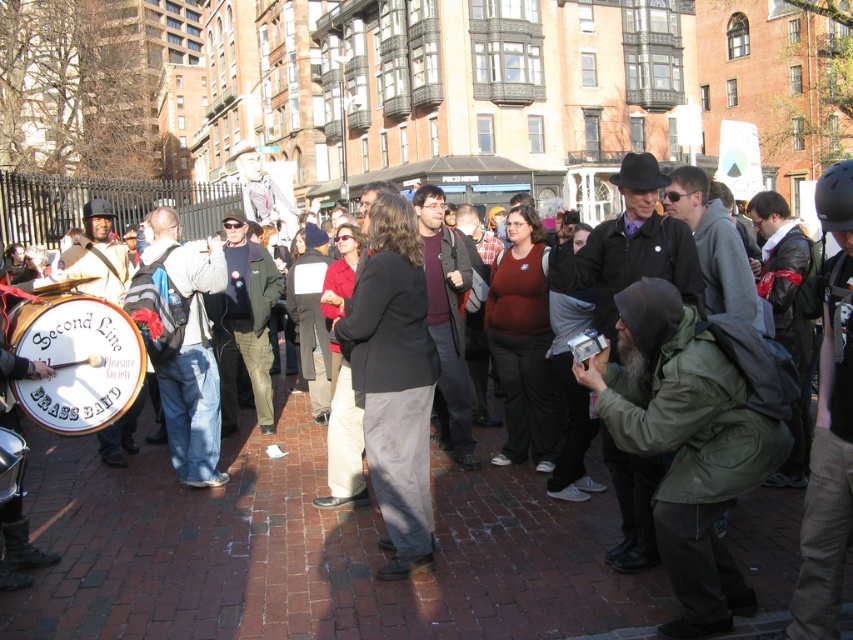
You are a photographer standing at the edge of the plaza. You want to take a photo that includes both the dark gray suit at center and the matte black drum at lower left. Given that your camera has a maximum focus range of 10 meters, will you be able to capture both subjects in focus?

The dark gray suit at center is 9.51 meters away from the matte black drum at lower left. Since the distance between them is within the camera maximum focus range of 10 meters, you can capture both subjects in focus.

You are a photographer at this event and want to capture both the dark gray suit at center and the matte black drum at lower left in the same frame. Which object should you position closer to the left edge of your camera viewfinder to include both?

To include both the dark gray suit at center and the matte black drum at lower left in the same frame, position the matte black drum at lower left closer to the left edge of your camera viewfinder since the dark gray suit at center is already on its right side.

You are a photographer standing at the entrance of the plaza. You want to take a photo of the dark gray suit at center. Where should you position yourself to capture the subject in the best possible frame?

The dark gray suit at center is located at point (393, 380), so you should position yourself directly in front of that coordinate to ensure the subject is centered in your frame.